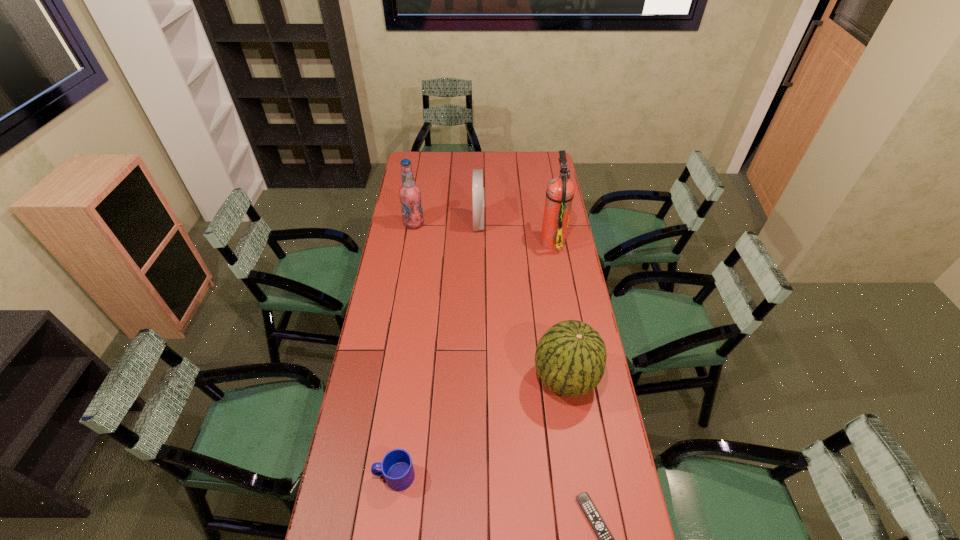
Find the location of a particular element. The image size is (960, 540). vacant space at the left edge of the desktop is located at coordinates (410, 230).

This screenshot has height=540, width=960. I want to click on vacant space at the right edge of the desktop, so click(536, 192).

Image resolution: width=960 pixels, height=540 pixels. In the image, there is a desktop. In order to click on vacant space at the far left corner in this screenshot , I will do pos(419,154).

Locate an element on the screen. free space between the alcohol and the fourth farthest object is located at coordinates (490, 301).

Where is `vacant space that's between the fifth farthest object and the third object from left to right`? vacant space that's between the fifth farthest object and the third object from left to right is located at coordinates (437, 349).

Find the location of a particular element. This screenshot has height=540, width=960. empty space that is in between the third nearest object and the tallest object is located at coordinates point(559,310).

The height and width of the screenshot is (540, 960). Find the location of `free spot between the fifth shortest object and the watermelon`. free spot between the fifth shortest object and the watermelon is located at coordinates (490, 301).

This screenshot has height=540, width=960. In order to click on empty space between the fifth tallest object and the tallest object in this screenshot , I will do `click(473, 358)`.

Where is `vacant region between the alcohol and the first-aid kit`? The image size is (960, 540). vacant region between the alcohol and the first-aid kit is located at coordinates (446, 223).

Select which object is the fifth closest to the third nearest object. Please provide its 2D coordinates. Your answer should be formatted as a tuple, i.e. [(x, y)], where the tuple contains the x and y coordinates of a point satisfying the conditions above.

[(410, 195)]